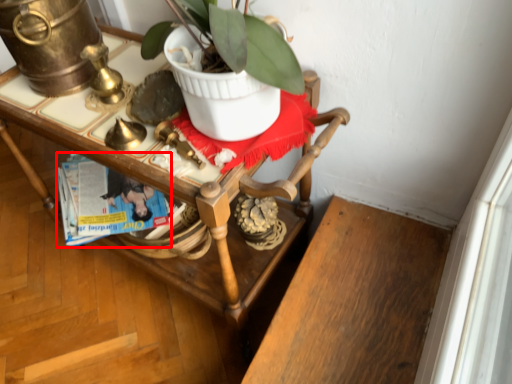
Question: From the image, what is the correct spatial relationship of magazine (annotated by the red box) in relation to desk?

Choices:
 (A) right
 (B) left

Answer: (B)